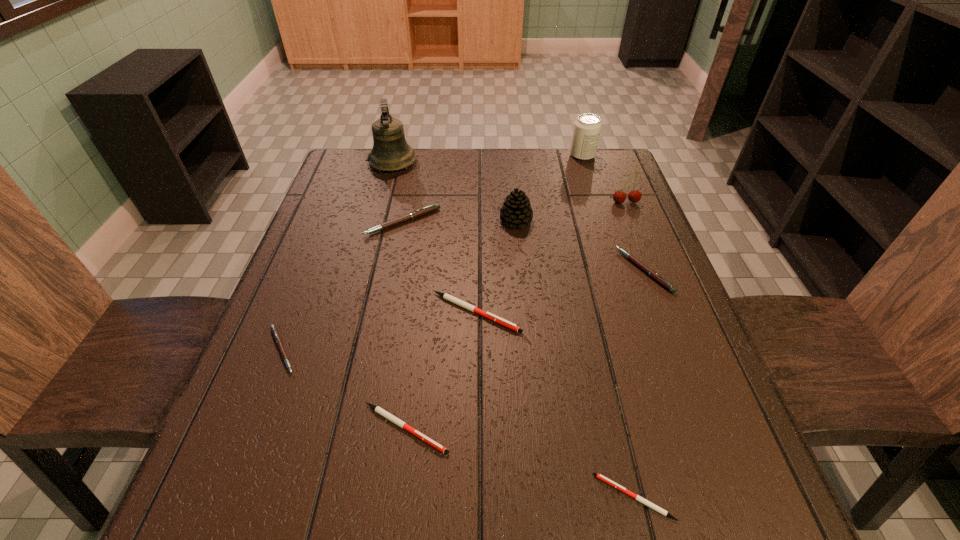
Find the location of a particular element. pink pen that is the third closest to the ninth shortest object is located at coordinates (277, 338).

Locate an element on the screen. pink pen that is the closest one to the pinecone is located at coordinates (434, 207).

In order to click on white pen that is the third closest to the ninth shortest object in this screenshot , I will do `click(599, 476)`.

You are a GUI agent. You are given a task and a screenshot of the screen. Output one action in this format:
    pyautogui.click(x=<x>, y=<y>)
    Task: Click on the white pen that is the second nearest to the biggest white pen
    Image resolution: width=960 pixels, height=540 pixels.
    Given the screenshot: What is the action you would take?
    pyautogui.click(x=599, y=476)

I want to click on free location that satisfies the following two spatial constraints: 1. on the surface of the cherry; 2. at the nib of the leftmost pen, so click(x=684, y=350).